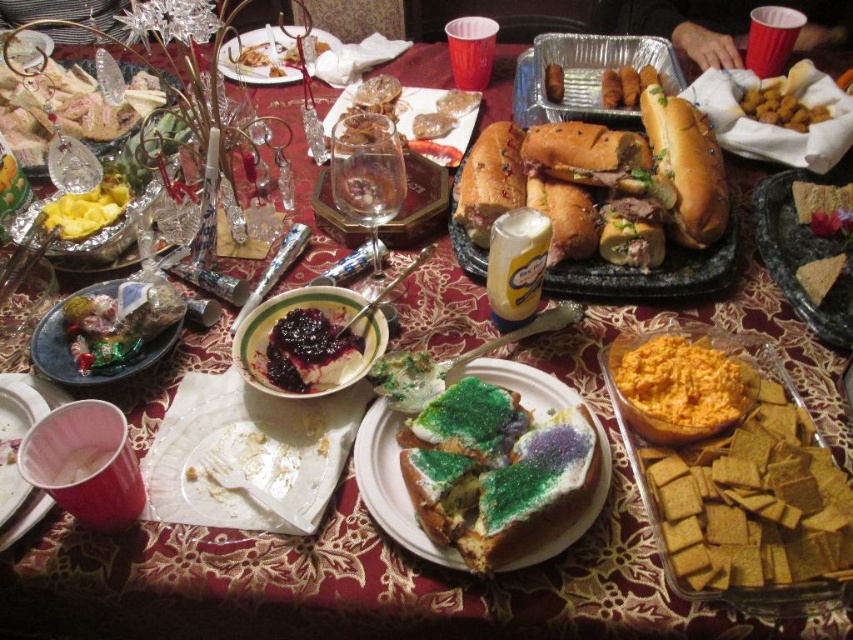
You are a guest at the party and want to reach the white paper plate at center to grab a piece of King Cake. You are currently holding a 12 inch long serving spoon. Can you safely extend your arm to reach the plate without knocking anything over?

The white paper plate at center is 25.36 inches from camera. Since your arm length is typically longer than 12 inches, and the spoon adds another 12 inches, the total reach would be around 24 inches. This is slightly shorter than the 25.36 inches distance, so you might need to move closer to the table to safely reach the plate without risking knocking items over.

You are a guest at the table and want to place your crackers on the plate. Can you move the brown textured crackers at right onto the white paper plate at center without moving the plate?

The white paper plate at center is positioned under the brown textured crackers at right, so yes, you can move the brown textured crackers at right onto the white paper plate at center without moving the plate.